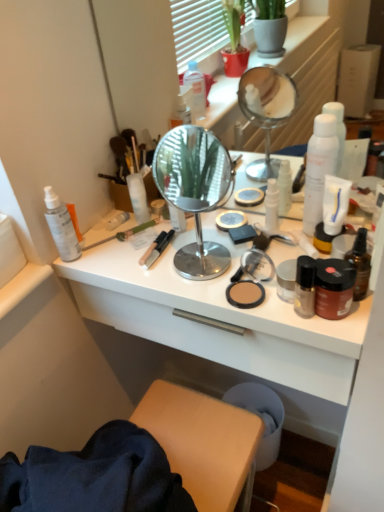
Identify the location of free space between white matte spray can at left, the seventh toiletry in the right-to-left sequence, and white matte spray can at right, the second bottle from the front. The width and height of the screenshot is (384, 512). (185, 243).